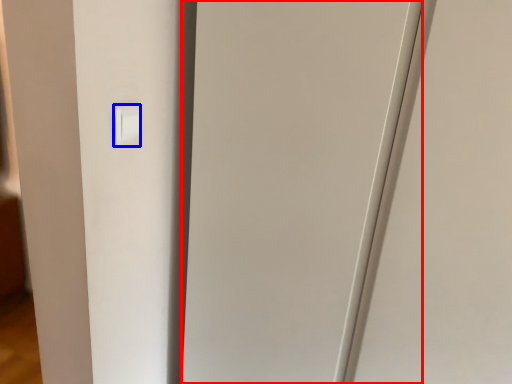
Question: Which point is further to the camera, glass door (highlighted by a red box) or light switch (highlighted by a blue box)?

Choices:
 (A) glass door
 (B) light switch

Answer: (B)